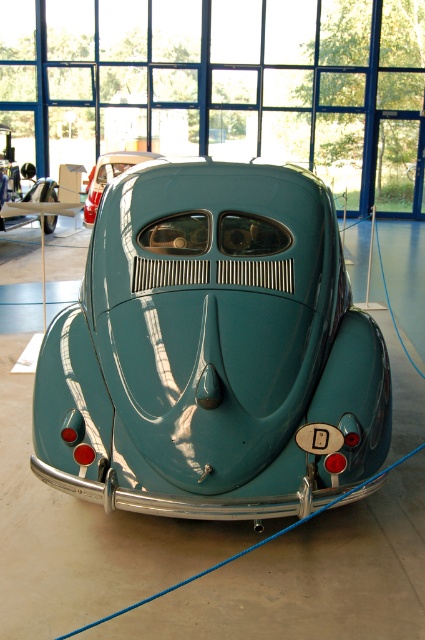
Question: Can you confirm if glossy teal car at center is smaller than teal glossy car at center?

Choices:
 (A) no
 (B) yes

Answer: (A)

Question: In this image, where is glossy teal car at center located relative to teal glossy car at center?

Choices:
 (A) above
 (B) below

Answer: (B)

Question: Is glossy teal car at center further to the viewer compared to teal glossy car at center?

Choices:
 (A) yes
 (B) no

Answer: (B)

Question: Which of the following is the closest to the observer?

Choices:
 (A) glossy teal car at center
 (B) teal glossy car at center

Answer: (A)

Question: Which of the following is the farthest from the observer?

Choices:
 (A) glossy teal car at center
 (B) teal glossy car at center

Answer: (B)